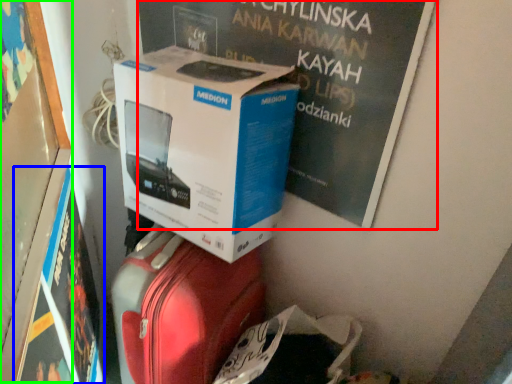
Question: Considering the real-world distances, which object is closest to magazine (highlighted by a red box)? magazine (highlighted by a blue box) or bulletin board (highlighted by a green box).

Choices:
 (A) magazine
 (B) bulletin board

Answer: (B)